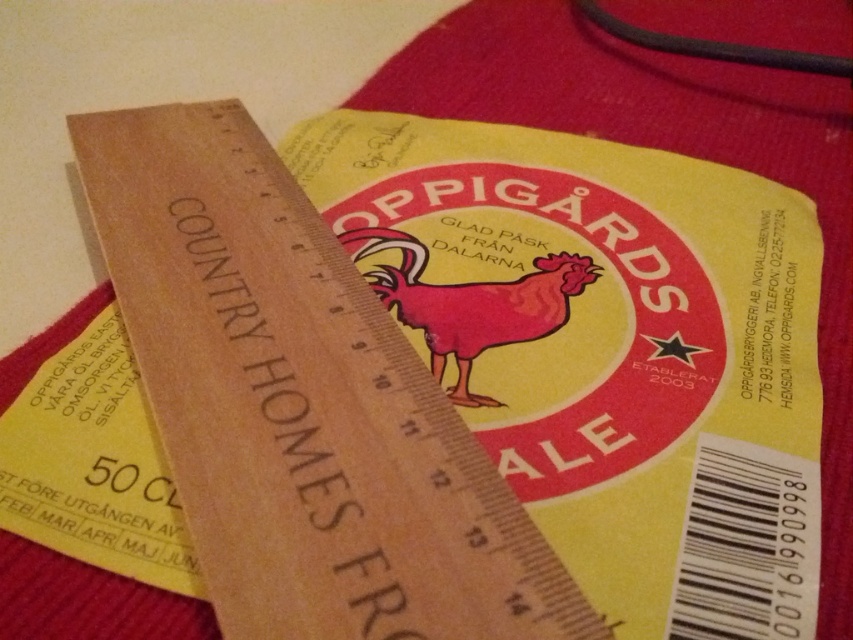
Looking at this image, you are trying to place a matte red chicken at center on a shelf next to a wooden ruler at center. Based on their positions in the image, which object should you move first to make space?

The wooden ruler at center is to the left of the matte red chicken at center. To make space, you should move the wooden ruler at center first since it is positioned to the left of the chicken and moving it would free up space to the right.

You are examining a ruler placed diagonally over a yellow beer label. The ruler has markings from 0 to 14 centimeters. There is a specific point labeled as point (300,404) in the image. Based on the ruler, what does this point correspond to?

The point (300,404) corresponds to the wooden ruler at center.

You are trying to place a matte red chicken at center on top of a wooden ruler at center in the image. Is this possible based on their current positions?

The wooden ruler at center is located below the matte red chicken at center, so placing the matte red chicken at center on top of the wooden ruler at center is possible since the ruler is underneath.